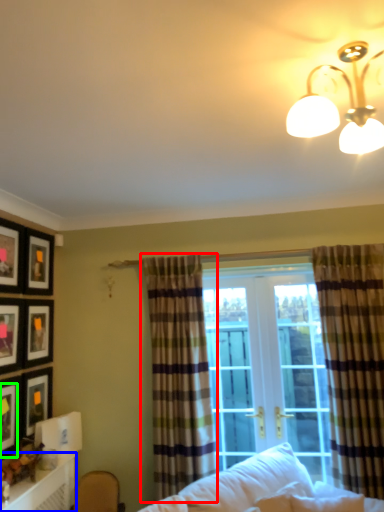
Question: Considering the real-world distances, which object is closest to curtain (highlighted by a red box)? table (highlighted by a blue box) or picture frame (highlighted by a green box).

Choices:
 (A) table
 (B) picture frame

Answer: (A)